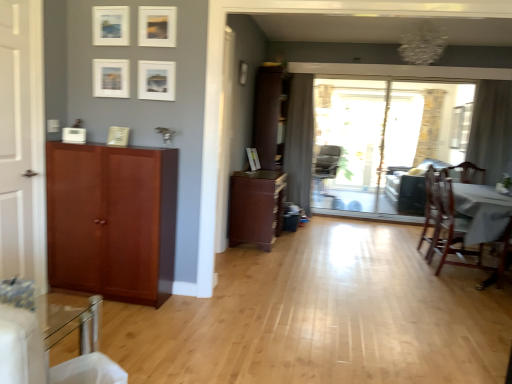
Question: Considering the relative positions of gray fabric curtain at center, the 2th curtain when ordered from front to back, and sheer fabric curtain at right, the 1th curtain viewed from the front, in the image provided, is gray fabric curtain at center, the 2th curtain when ordered from front to back, to the left of sheer fabric curtain at right, the 1th curtain viewed from the front, from the viewer's perspective?

Choices:
 (A) yes
 (B) no

Answer: (A)

Question: Is gray fabric curtain at center, placed as the 1th curtain when sorted from left to right, facing towards sheer fabric curtain at right, marked as the 2th curtain in a back-to-front arrangement?

Choices:
 (A) yes
 (B) no

Answer: (B)

Question: Is gray fabric curtain at center, the 2th curtain when ordered from front to back, wider than sheer fabric curtain at right, marked as the first curtain in a right-to-left arrangement?

Choices:
 (A) no
 (B) yes

Answer: (B)

Question: Can you confirm if gray fabric curtain at center, the 2th curtain when ordered from front to back, is shorter than sheer fabric curtain at right, marked as the first curtain in a right-to-left arrangement?

Choices:
 (A) yes
 (B) no

Answer: (B)

Question: Is gray fabric curtain at center, which is counted as the 2th curtain, starting from the right, thinner than sheer fabric curtain at right, marked as the 2th curtain in a back-to-front arrangement?

Choices:
 (A) yes
 (B) no

Answer: (B)

Question: Relative to matte white picture frame at upper center, marked as the second picture frame in a left-to-right arrangement, is sheer fabric curtain at right, the 1th curtain viewed from the front, in front or behind?

Choices:
 (A) behind
 (B) front

Answer: (A)

Question: From a real-world perspective, is sheer fabric curtain at right, marked as the first curtain in a right-to-left arrangement, above or below matte white picture frame at upper center, which ranks as the 6th picture frame in right-to-left order?

Choices:
 (A) above
 (B) below

Answer: (B)

Question: Looking at the image, does sheer fabric curtain at right, marked as the first curtain in a right-to-left arrangement, seem bigger or smaller compared to matte white picture frame at upper center, placed as the fifth picture frame when sorted from back to front?

Choices:
 (A) big
 (B) small

Answer: (A)

Question: From the image's perspective, relative to matte white picture frame at upper center, which is counted as the 3th picture frame, starting from the front, is sheer fabric curtain at right, marked as the 2th curtain in a back-to-front arrangement, above or below?

Choices:
 (A) above
 (B) below

Answer: (B)

Question: Is matte white picture frame at center, acting as the 1th picture frame starting from the right, in front of or behind matte white picture frame at upper center, which is the 3th picture frame from right to left, in the image?

Choices:
 (A) behind
 (B) front

Answer: (A)

Question: Is matte white picture frame at center, acting as the 1th picture frame starting from the right, to the left or to the right of matte white picture frame at upper center, positioned as the 1th picture frame in front-to-back order, in the image?

Choices:
 (A) left
 (B) right

Answer: (B)

Question: From a real-world perspective, is matte white picture frame at center, placed as the first picture frame when sorted from back to front, physically located above or below matte white picture frame at upper center, which is the 3th picture frame from right to left?

Choices:
 (A) below
 (B) above

Answer: (A)

Question: Is matte white picture frame at center, which ranks as the seventh picture frame in front-to-back order, wider or thinner than matte white picture frame at upper center, acting as the 5th picture frame starting from the left?

Choices:
 (A) thin
 (B) wide

Answer: (B)

Question: In the image, is matte white picture frame at upper center, which ranks as the 6th picture frame in right-to-left order, positioned in front of or behind sheer fabric curtain at right, the 1th curtain viewed from the front?

Choices:
 (A) behind
 (B) front

Answer: (B)

Question: From the image's perspective, is matte white picture frame at upper center, which is counted as the 3th picture frame, starting from the front, positioned above or below sheer fabric curtain at right, marked as the first curtain in a right-to-left arrangement?

Choices:
 (A) above
 (B) below

Answer: (A)